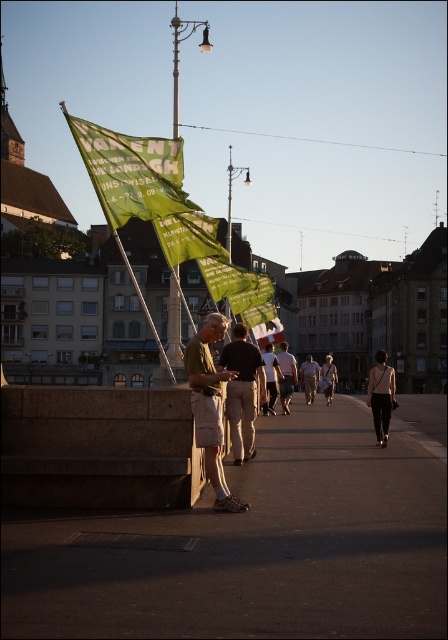
Question: Which object is positioned farthest from the metallic pole at center?

Choices:
 (A) khaki shorts at center
 (B) smooth concrete pavement at center
 (C) green fabric banner at upper center

Answer: (C)

Question: Is green fabric banner at upper center positioned in front of light brown leather pants at center?

Choices:
 (A) yes
 (B) no

Answer: (A)

Question: Which of the following is the closest to the observer?

Choices:
 (A) metallic pole at center
 (B) green fabric flag at center
 (C) khaki cotton shorts at center
 (D) light brown leather pants at center

Answer: (B)

Question: Among these points, which one is nearest to the camera?

Choices:
 (A) tap(233, 429)
 (B) tap(177, 168)

Answer: (A)

Question: From the image, what is the correct spatial relationship of khaki shorts at center in relation to light brown leather jacket at center?

Choices:
 (A) left
 (B) right

Answer: (A)

Question: Is green fabric banner at upper center thinner than dark gray pants at center?

Choices:
 (A) yes
 (B) no

Answer: (B)